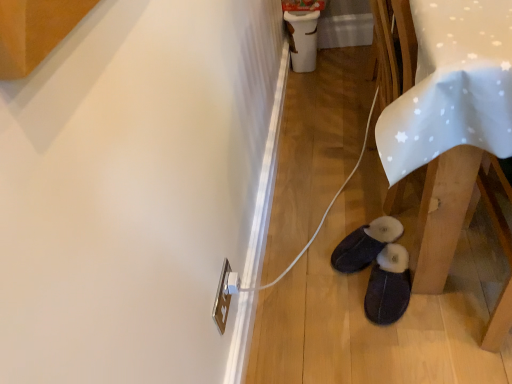
Image resolution: width=512 pixels, height=384 pixels. Find the location of `vacant space behind dark suede slippers at lower center, the 1th footwear from the back`. vacant space behind dark suede slippers at lower center, the 1th footwear from the back is located at coordinates (346, 211).